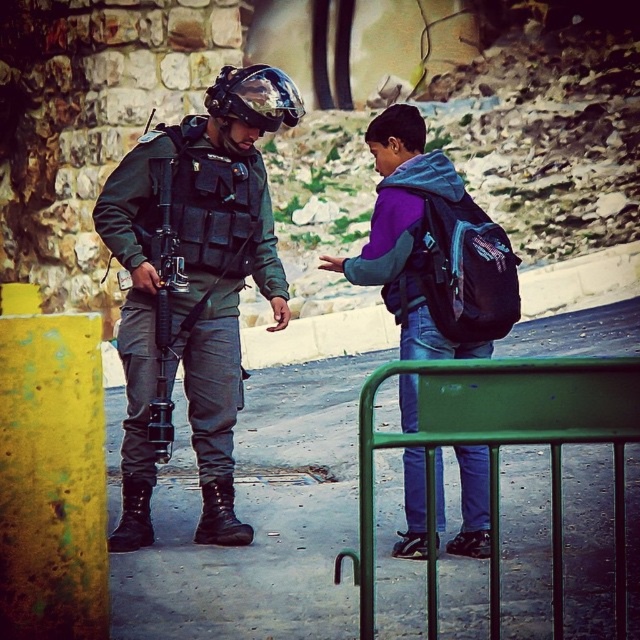
You are a drone operator trying to deliver a package from the matte black backpack at center right to the matte black uniform at center. The minimum safe distance for the drone to land is 10 feet. Can the drone land directly between them?

The matte black uniform at center is 13.17 feet from the matte black backpack at center right. Since the distance is greater than 10 feet, the drone can safely land between them as the distance allows for a safe landing zone.

You are a drone operator observing a military exercise. You see the matte black uniform at center and the green metal barricade at center. Which object is positioned to the east of the other?

The matte black uniform at center is to the left of the green metal barricade at center. Since left typically corresponds to west in such scenarios, the green metal barricade at center is positioned to the east of the matte black uniform at center.

Consider the image. What object is located at the coordinates point (193, 285)?

The point (193, 285) corresponds to the matte black uniform at center.